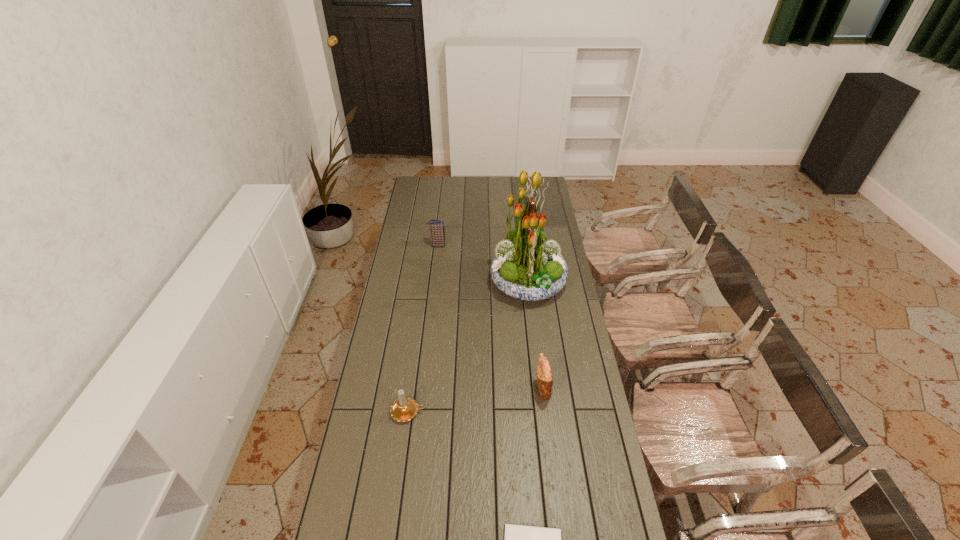
Where is `free space between the farther clutch bag and the right clutch bag`? Image resolution: width=960 pixels, height=540 pixels. free space between the farther clutch bag and the right clutch bag is located at coordinates (491, 317).

Where is `empty location between the flower arrangement and the left clutch bag`? This screenshot has width=960, height=540. empty location between the flower arrangement and the left clutch bag is located at coordinates (483, 264).

Locate an element on the screen. free space between the flower arrangement and the candle is located at coordinates (468, 348).

Identify the location of empty space that is in between the candle and the right clutch bag. The height and width of the screenshot is (540, 960). (475, 401).

At what (x,y) coordinates should I click in order to perform the action: click on empty space that is in between the flower arrangement and the candle. Please return your answer as a coordinate pair (x, y). Looking at the image, I should click on (468, 348).

Where is `free space that is in between the fourth nearest object and the nearer clutch bag`? The image size is (960, 540). free space that is in between the fourth nearest object and the nearer clutch bag is located at coordinates (536, 336).

I want to click on free space that is in between the left clutch bag and the candle, so click(423, 328).

Where is `object that stands as the second closest to the left clutch bag`? This screenshot has width=960, height=540. object that stands as the second closest to the left clutch bag is located at coordinates (544, 372).

At what (x,y) coordinates should I click in order to perform the action: click on object that stands as the third closest to the candle. Please return your answer as a coordinate pair (x, y). Image resolution: width=960 pixels, height=540 pixels. Looking at the image, I should click on (526, 267).